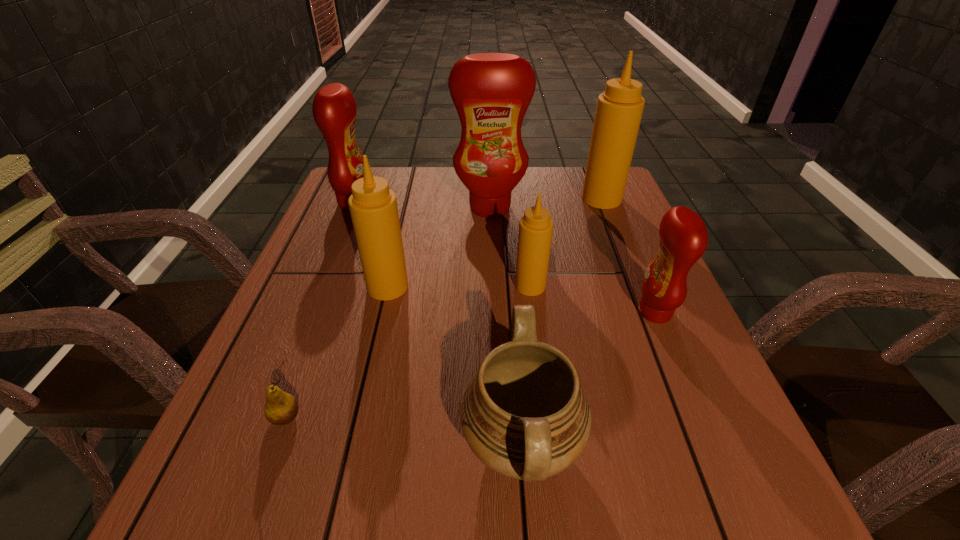
Find the location of a particular element. Image resolution: width=960 pixels, height=540 pixels. the second red condiment from left to right is located at coordinates (491, 92).

The height and width of the screenshot is (540, 960). I want to click on the biggest tan condiment, so click(619, 110).

Image resolution: width=960 pixels, height=540 pixels. I want to click on the rightmost tan condiment, so click(x=619, y=110).

At what (x,y) coordinates should I click in order to perform the action: click on the leftmost tan condiment. Please return your answer as a coordinate pair (x, y). Looking at the image, I should click on (373, 207).

At what (x,y) coordinates should I click in order to perform the action: click on the second condiment from left to right. Please return your answer as a coordinate pair (x, y). This screenshot has width=960, height=540. Looking at the image, I should click on (373, 207).

You are a GUI agent. You are given a task and a screenshot of the screen. Output one action in this format:
    pyautogui.click(x=<x>, y=<y>)
    Task: Click on the leftmost condiment
    
    Given the screenshot: What is the action you would take?
    pyautogui.click(x=334, y=109)

The width and height of the screenshot is (960, 540). I want to click on the leftmost red condiment, so click(x=334, y=109).

Find the location of `the second tan condiment from right to left`. the second tan condiment from right to left is located at coordinates 536,227.

Image resolution: width=960 pixels, height=540 pixels. What are the coordinates of `the nearest red condiment` in the screenshot? It's located at (683, 235).

Image resolution: width=960 pixels, height=540 pixels. I want to click on the smallest red condiment, so point(683,235).